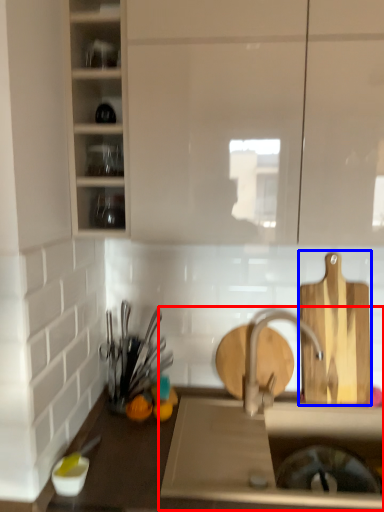
Question: Which point is further to the camera, sink (highlighted by a red box) or cutting board (highlighted by a blue box)?

Choices:
 (A) sink
 (B) cutting board

Answer: (B)